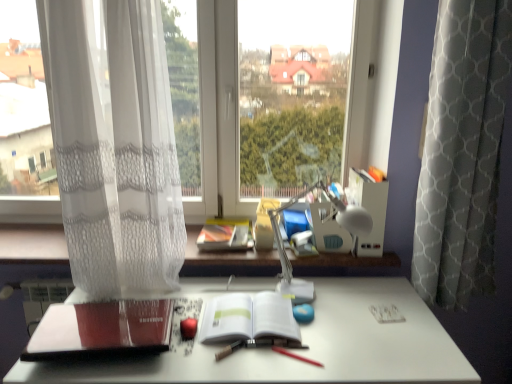
Find the location of a particular element. The height and width of the screenshot is (384, 512). vacant space that is in between red matte book at lower left, marked as the 2th paperback book in a right-to-left arrangement, and white paper at center, marked as the 2th paperback book in a left-to-right arrangement is located at coordinates (212, 340).